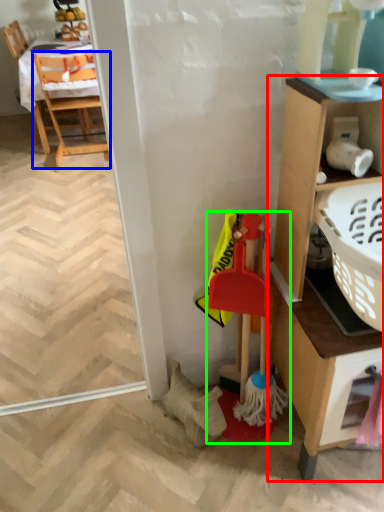
Question: Considering the real-world distances, which object is farthest from cabinetry (highlighted by a red box)? chair (highlighted by a blue box) or toy (highlighted by a green box)?

Choices:
 (A) chair
 (B) toy

Answer: (A)